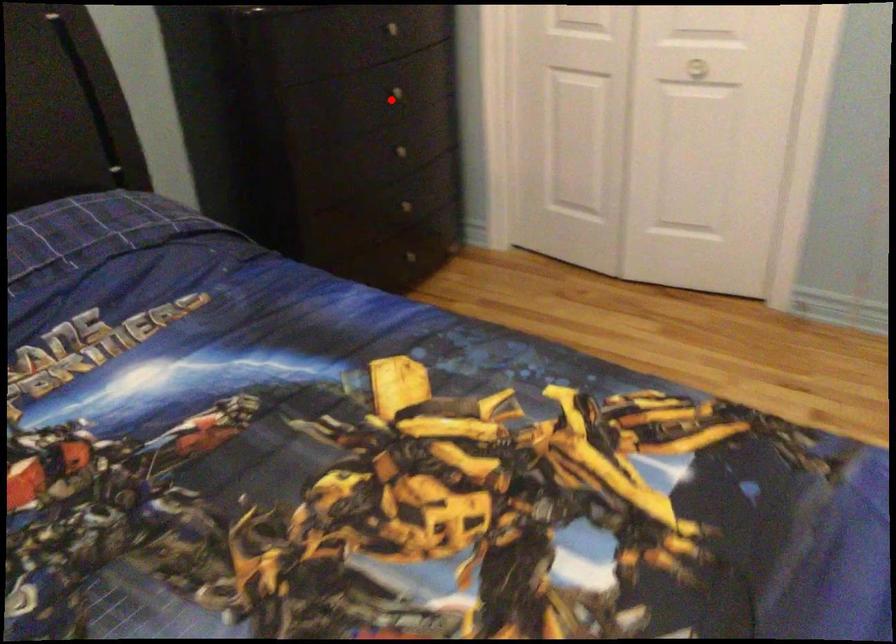
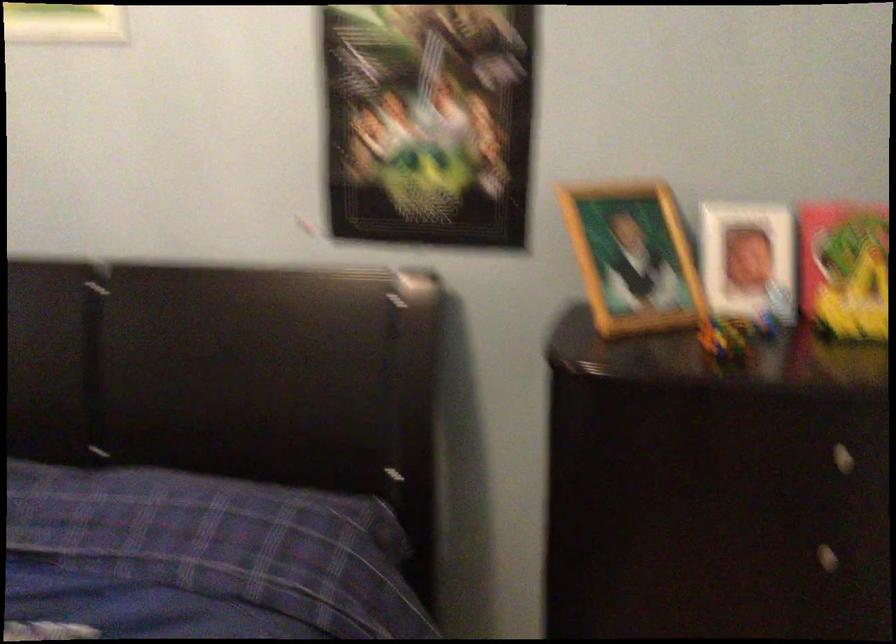
Question: I am providing you with two images of the same scene from different viewpoints. Image1 has a red point marked. In image2, the corresponding 3D location appears at what relative position? Reply with the corresponding letter.

Choices:
 (A) Closer
 (B) Farther

Answer: (A)